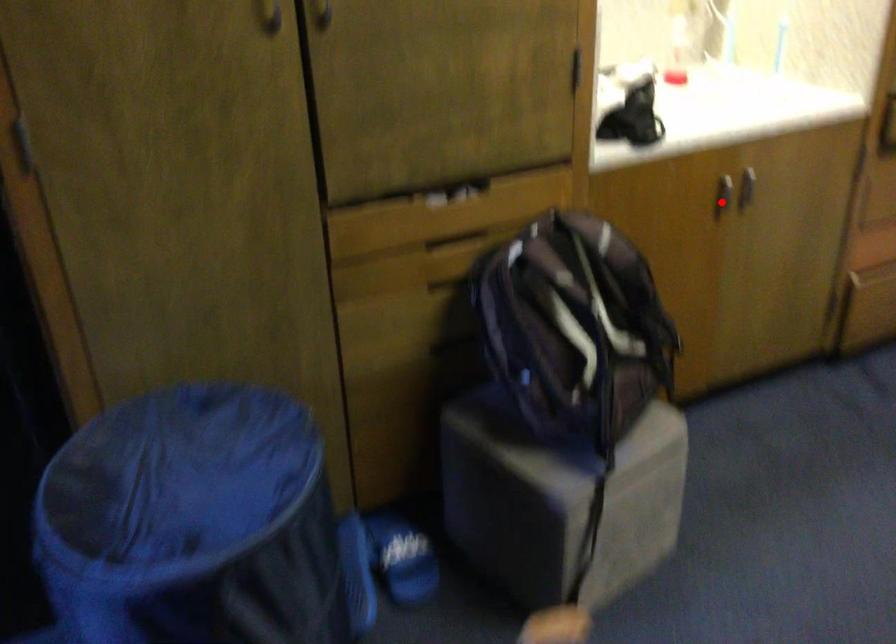
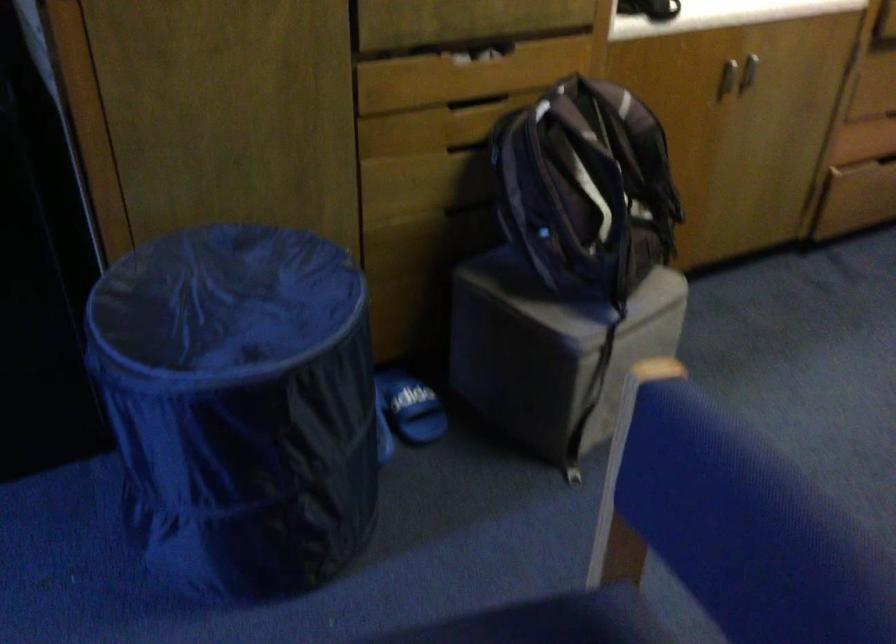
Find the pixel in the second image that matches the highlighted location in the first image.

(728, 79)